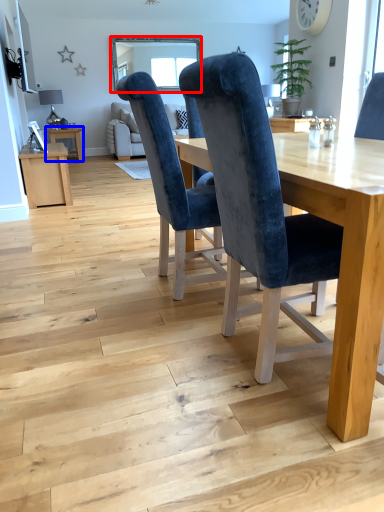
Question: Which object appears closest to the camera in this image, window screen (highlighted by a red box) or table (highlighted by a blue box)?

Choices:
 (A) window screen
 (B) table

Answer: (B)